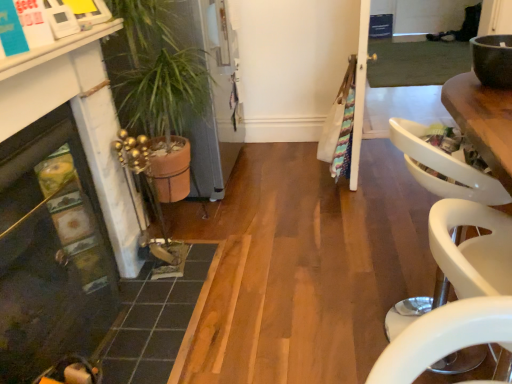
The image size is (512, 384). In order to click on free space behind dark gray tile at lower left in this screenshot , I will do `click(222, 215)`.